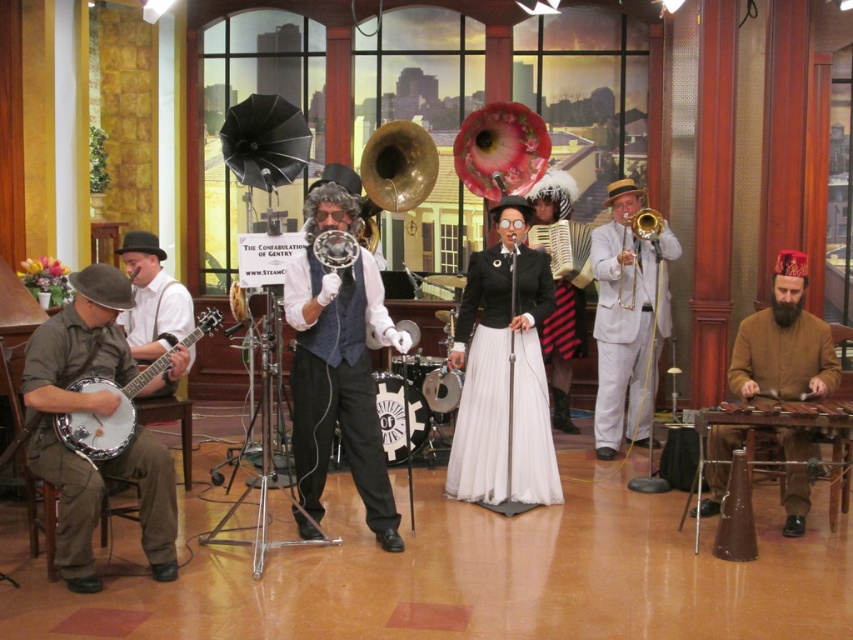
You are a photographer standing at the camera position. You want to take a photo of the musician wearing the black satin dress at center. Is the distance between you and the musician sufficient to capture a clear, focused image with your standard zoom lens? Assume your lens has a minimum focusing distance of 10 feet.

The distance between the black satin dress at center and the camera is 17.29 feet, which is greater than the minimum focusing distance of 10 feet. Therefore, the photographer can capture a clear, focused image of the musician wearing the black satin dress at center.

You are a photographer setting up for a photoshoot in the studio. You need to position a spotlight that can cover both the black satin dress at center and the brown woolen robe at lower right. Considering their sizes, which object requires a larger spotlight to fully illuminate it?

The brown woolen robe at lower right requires a larger spotlight because it has a bigger size compared to the black satin dress at center.